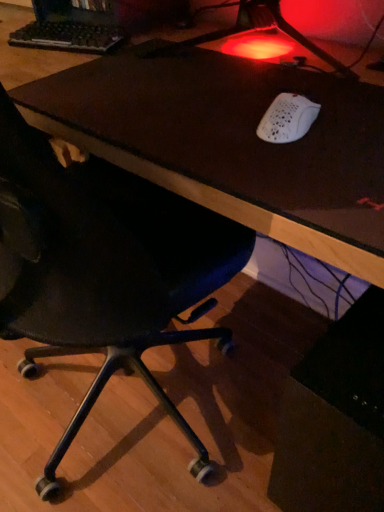
This screenshot has width=384, height=512. Identify the location of free point behind white matte mouse at upper right. (254, 88).